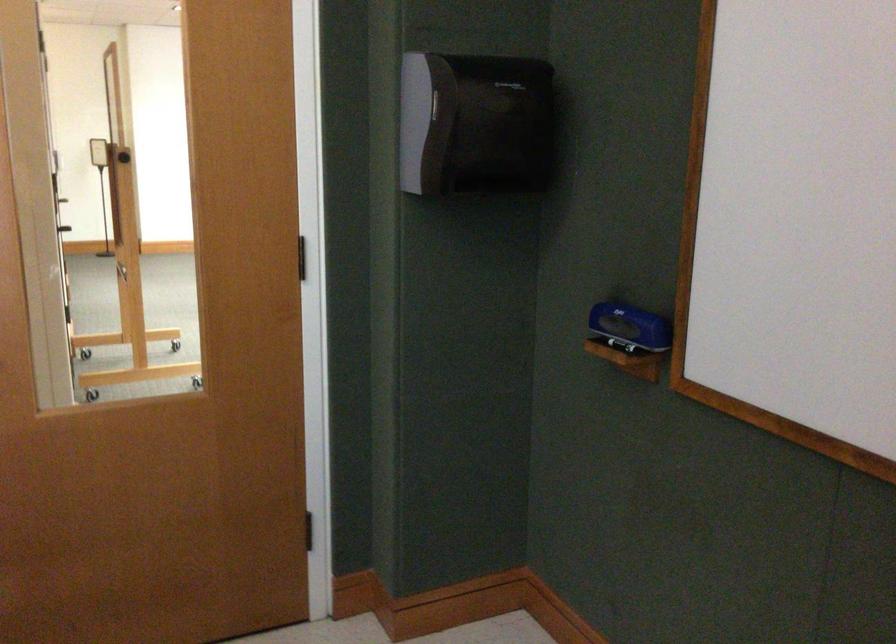
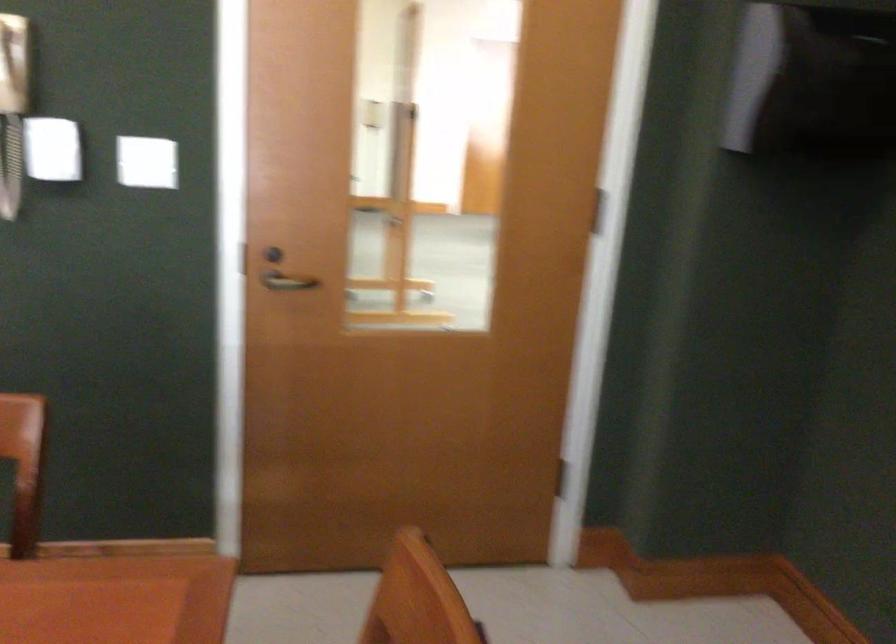
Question: The camera is either moving clockwise (left) or counter-clockwise (right) around the object. The first image is from the beginning of the video and the second image is from the end. Is the camera moving left or right when shooting the video?

Choices:
 (A) Left
 (B) Right

Answer: (B)